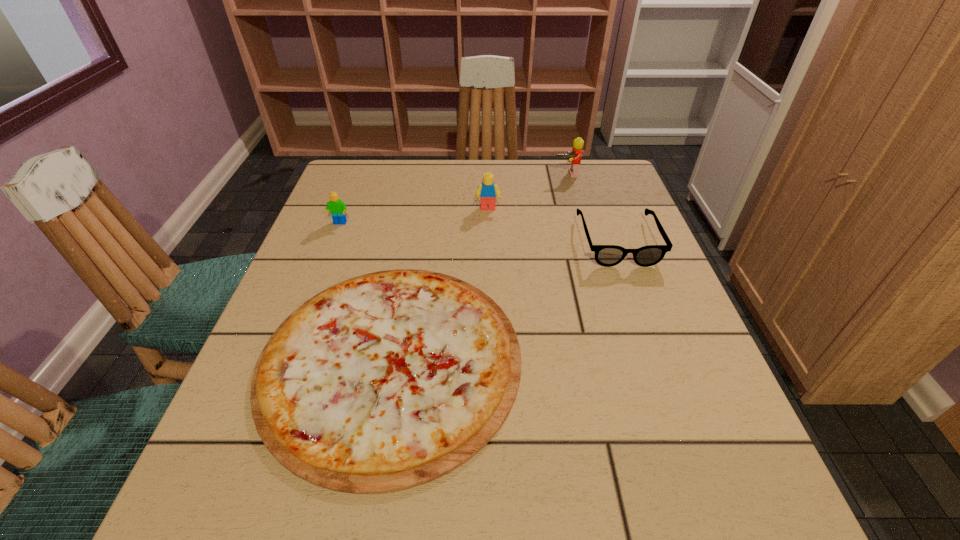
Where is `object that is at the far right corner`? This screenshot has width=960, height=540. object that is at the far right corner is located at coordinates (574, 157).

This screenshot has height=540, width=960. What are the coordinates of `blank area at the far edge` in the screenshot? It's located at (513, 164).

In the image, there is a desktop. Where is `free region at the near edge`? The image size is (960, 540). free region at the near edge is located at coordinates (331, 498).

Locate an element on the screen. vacant space at the left edge of the desktop is located at coordinates (345, 246).

This screenshot has width=960, height=540. What are the coordinates of `free space at the right edge of the desktop` in the screenshot? It's located at (636, 230).

Find the location of `vacant space at the far right corner`. vacant space at the far right corner is located at coordinates (609, 194).

I want to click on vacant region at the near right corner of the desktop, so point(771,496).

Find the location of a particular element. This screenshot has height=540, width=960. free space between the leftmost Lego and the fourth tallest object is located at coordinates (479, 232).

This screenshot has width=960, height=540. Identify the location of vacant area that lies between the spectacles and the second nearest Lego. (553, 225).

Image resolution: width=960 pixels, height=540 pixels. Find the location of `free space between the farthest Lego and the fourth nearest object`. free space between the farthest Lego and the fourth nearest object is located at coordinates (527, 191).